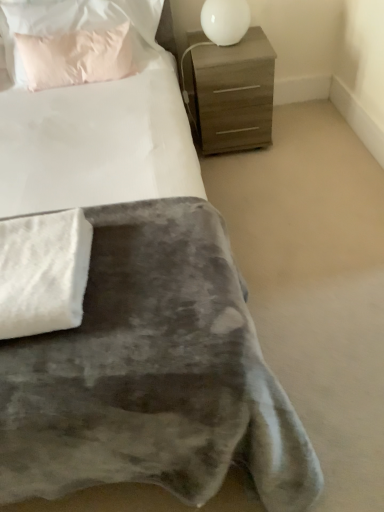
The width and height of the screenshot is (384, 512). I want to click on blank space above matte brown chest of drawers at upper right (from a real-world perspective), so click(229, 49).